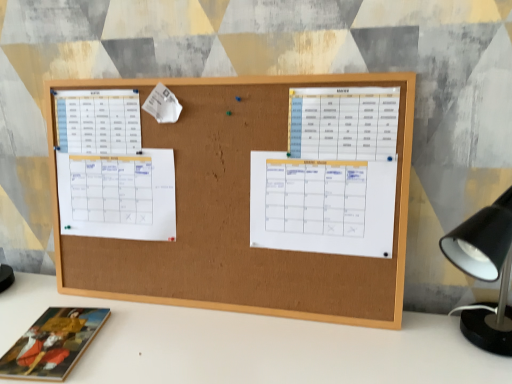
The height and width of the screenshot is (384, 512). What do you see at coordinates (118, 195) in the screenshot?
I see `white paper calendar at left, which ranks as the 2th list in left-to-right order` at bounding box center [118, 195].

Describe the element at coordinates (98, 121) in the screenshot. This screenshot has width=512, height=384. I see `white paper at left, which is counted as the fourth list, starting from the right` at that location.

This screenshot has width=512, height=384. Identify the location of corkboard at center. coord(240,217).

What do you see at coordinates (53, 344) in the screenshot? I see `wooden book at lower left` at bounding box center [53, 344].

I want to click on white paper calendar at left, the third list when ordered from right to left, so (x=118, y=195).

Is white paper at left, which is counted as the fourth list, starting from the right, thinner than white paper calendar at left, the third list when ordered from right to left?

Yes.

Is white paper at left, which is counted as the fourth list, starting from the right, turned away from white paper calendar at left, which ranks as the 2th list in left-to-right order?

No, white paper at left, which is counted as the fourth list, starting from the right,'s orientation is not away from white paper calendar at left, which ranks as the 2th list in left-to-right order.

Which is closer to the camera, (78, 125) or (150, 236)?

Point (78, 125) appears to be farther away from the viewer than point (150, 236).

Can you tell me how much white paper calendar at center, positioned as the third list in left-to-right order, and white paper at left, which is counted as the fourth list, starting from the right, differ in facing direction?

The angle between the facing direction of white paper calendar at center, positioned as the third list in left-to-right order, and the facing direction of white paper at left, which is counted as the fourth list, starting from the right, is 0.00673 degrees.

Considering the relative sizes of white paper calendar at center, marked as the second list in a right-to-left arrangement, and white paper at left, which ranks as the first list in left-to-right order, in the image provided, is white paper calendar at center, marked as the second list in a right-to-left arrangement, shorter than white paper at left, which ranks as the first list in left-to-right order,?

Incorrect, the height of white paper calendar at center, marked as the second list in a right-to-left arrangement, does not fall short of that of white paper at left, which ranks as the first list in left-to-right order.

Is white paper calendar at center, positioned as the third list in left-to-right order, in contact with white paper at left, which is counted as the fourth list, starting from the right?

There is a gap between white paper calendar at center, positioned as the third list in left-to-right order, and white paper at left, which is counted as the fourth list, starting from the right.

In the scene shown: From the image's perspective, is white paper calendar at center, marked as the second list in a right-to-left arrangement, below white paper at left, which is counted as the fourth list, starting from the right?

Yes, from the image's perspective, white paper calendar at center, marked as the second list in a right-to-left arrangement, is beneath white paper at left, which is counted as the fourth list, starting from the right.

Between white paper calendar at left, which ranks as the 2th list in left-to-right order, and wooden book at lower left, which one has smaller width?

white paper calendar at left, which ranks as the 2th list in left-to-right order.

Which point is more distant from viewer, (124, 207) or (23, 338)?

Point (124, 207)

In the scene shown: Relative to wooden book at lower left, is white paper calendar at left, the third list when ordered from right to left, in front or behind?

white paper calendar at left, the third list when ordered from right to left, is positioned farther from the viewer than wooden book at lower left.

Is white paper calendar at left, the third list when ordered from right to left, next to wooden book at lower left and touching it?

No, white paper calendar at left, the third list when ordered from right to left, is not in contact with wooden book at lower left.

Is white paper calendar at center, arranged as the 1th list when viewed from the right, to the left or to the right of white paper calendar at left, which ranks as the 2th list in left-to-right order, in the image?

Clearly, white paper calendar at center, arranged as the 1th list when viewed from the right, is on the right of white paper calendar at left, which ranks as the 2th list in left-to-right order, in the image.

Considering the points (337, 119) and (165, 165), which point is behind, point (337, 119) or point (165, 165)?

Positioned behind is point (165, 165).

Considering the relative positions of white paper calendar at center, which ranks as the 4th list in left-to-right order, and white paper calendar at left, which ranks as the 2th list in left-to-right order, in the image provided, is white paper calendar at center, which ranks as the 4th list in left-to-right order, behind white paper calendar at left, which ranks as the 2th list in left-to-right order,?

No, it is not.

Based on the photo, from the image's perspective, relative to white paper calendar at left, which ranks as the 2th list in left-to-right order, is white paper calendar at center, arranged as the 1th list when viewed from the right, above or below?

Clearly, from the image's perspective, white paper calendar at center, arranged as the 1th list when viewed from the right, is above white paper calendar at left, which ranks as the 2th list in left-to-right order.

Does corkboard at center have a smaller size compared to wooden book at lower left?

No, corkboard at center is not smaller than wooden book at lower left.

From the image's perspective, which is above, corkboard at center or wooden book at lower left?

corkboard at center is shown above in the image.

Is point (330, 285) more distant than point (104, 312)?

No.

How far apart are corkboard at center and wooden book at lower left?

33.22 centimeters.

Which is in front, point (28, 352) or point (332, 176)?

The point (28, 352) is more forward.

Is wooden book at lower left far away from white paper calendar at center, positioned as the third list in left-to-right order?

wooden book at lower left is actually quite close to white paper calendar at center, positioned as the third list in left-to-right order.

From the image's perspective, who appears lower, wooden book at lower left or white paper calendar at center, positioned as the third list in left-to-right order?

wooden book at lower left, from the image's perspective.

Locate an element on the screen. book on the left side of white paper calendar at center, positioned as the third list in left-to-right order is located at coordinates (53, 344).

Is white paper at left, which is counted as the fourth list, starting from the right, positioned far away from corkboard at center?

No, there isn't a large distance between white paper at left, which is counted as the fourth list, starting from the right, and corkboard at center.

Is white paper at left, which is counted as the fourth list, starting from the right, completely or partially outside of corkboard at center?

Indeed, white paper at left, which is counted as the fourth list, starting from the right, is completely outside corkboard at center.

Considering the relative sizes of white paper at left, which ranks as the first list in left-to-right order, and corkboard at center in the image provided, is white paper at left, which ranks as the first list in left-to-right order, shorter than corkboard at center?

Indeed, white paper at left, which ranks as the first list in left-to-right order, has a lesser height compared to corkboard at center.

Where is `bulletin board on the right of the white paper at left, which is counted as the fourth list, starting from the right`? This screenshot has width=512, height=384. bulletin board on the right of the white paper at left, which is counted as the fourth list, starting from the right is located at coordinates (240, 217).

Identify the location of the 2nd list above the white paper calendar at left, the third list when ordered from right to left (from a real-world perspective). (98, 121).

Where is `the 2nd list in front of the white paper at left, which is counted as the fourth list, starting from the right`? This screenshot has height=384, width=512. the 2nd list in front of the white paper at left, which is counted as the fourth list, starting from the right is located at coordinates (322, 205).

Based on their spatial positions, is wooden book at lower left or white paper calendar at center, which ranks as the 4th list in left-to-right order, closer to white paper calendar at center, positioned as the third list in left-to-right order?

Based on the image, white paper calendar at center, which ranks as the 4th list in left-to-right order, appears to be nearer to white paper calendar at center, positioned as the third list in left-to-right order.

In the scene shown: Looking at the image, which one is located closer to white paper at left, which is counted as the fourth list, starting from the right, white paper calendar at center, positioned as the third list in left-to-right order, or white paper calendar at center, which ranks as the 4th list in left-to-right order?

Based on the image, white paper calendar at center, positioned as the third list in left-to-right order, appears to be nearer to white paper at left, which is counted as the fourth list, starting from the right.

Looking at the image, which one is located further to white paper calendar at center, which ranks as the 4th list in left-to-right order, wooden book at lower left or white paper calendar at center, positioned as the third list in left-to-right order?

wooden book at lower left is further to white paper calendar at center, which ranks as the 4th list in left-to-right order.

Looking at the image, which one is located closer to white paper at left, which is counted as the fourth list, starting from the right, corkboard at center or white paper calendar at center, which ranks as the 4th list in left-to-right order?

The object closer to white paper at left, which is counted as the fourth list, starting from the right, is corkboard at center.

From the image, which object appears to be farther from white paper calendar at left, which ranks as the 2th list in left-to-right order, corkboard at center or wooden book at lower left?

The object further to white paper calendar at left, which ranks as the 2th list in left-to-right order, is wooden book at lower left.

Estimate the real-world distances between objects in this image. Which object is further from white paper calendar at center, marked as the second list in a right-to-left arrangement, white paper at left, which ranks as the first list in left-to-right order, or corkboard at center?

white paper at left, which ranks as the first list in left-to-right order.

Considering their positions, is white paper calendar at center, marked as the second list in a right-to-left arrangement, positioned closer to white paper calendar at left, the third list when ordered from right to left, than corkboard at center?

corkboard at center is positioned closer to the anchor white paper calendar at left, the third list when ordered from right to left.

When comparing their distances from white paper at left, which ranks as the first list in left-to-right order, does white paper calendar at center, marked as the second list in a right-to-left arrangement, or corkboard at center seem closer?

Among the two, corkboard at center is located nearer to white paper at left, which ranks as the first list in left-to-right order.

Image resolution: width=512 pixels, height=384 pixels. Find the location of `bulletin board between white paper at left, which ranks as the first list in left-to-right order, and wooden book at lower left vertically`. bulletin board between white paper at left, which ranks as the first list in left-to-right order, and wooden book at lower left vertically is located at coordinates (240, 217).

Identify the location of bulletin board between white paper calendar at left, the third list when ordered from right to left, and white paper calendar at center, positioned as the third list in left-to-right order. (240, 217).

What are the coordinates of `bulletin board between white paper calendar at left, which ranks as the 2th list in left-to-right order, and white paper calendar at center, which ranks as the 4th list in left-to-right order, from left to right` in the screenshot? It's located at (240, 217).

Where is `bulletin board between white paper at left, which ranks as the first list in left-to-right order, and white paper calendar at center, positioned as the third list in left-to-right order`? This screenshot has width=512, height=384. bulletin board between white paper at left, which ranks as the first list in left-to-right order, and white paper calendar at center, positioned as the third list in left-to-right order is located at coordinates (240, 217).